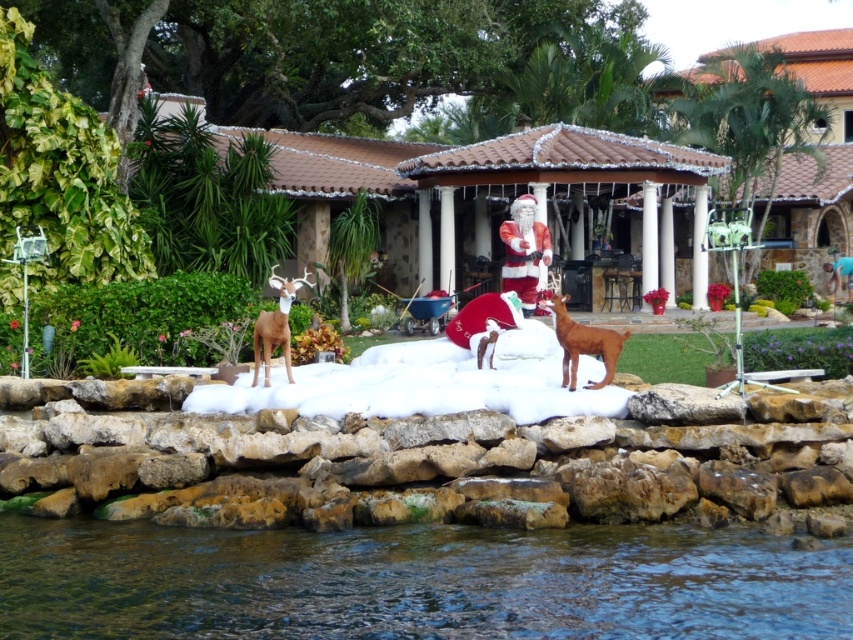
Question: Which point is farther to the camera?

Choices:
 (A) matte red santa at center
 (B) white fluffy snow at center

Answer: (A)

Question: Can you confirm if clear water at lower center is bigger than matte red santa at center?

Choices:
 (A) yes
 (B) no

Answer: (A)

Question: Which point is farther to the camera?

Choices:
 (A) (592, 385)
 (B) (367, 355)
 (C) (514, 214)
 (D) (260, 317)

Answer: (C)

Question: Which point is closer to the camera?

Choices:
 (A) (567, 360)
 (B) (393, 392)
 (C) (502, 227)

Answer: (B)

Question: Does brown matte dog at center have a greater width compared to shiny brown deer at center?

Choices:
 (A) no
 (B) yes

Answer: (A)

Question: Where is clear water at lower center located in relation to brown matte dog at center in the image?

Choices:
 (A) above
 (B) below

Answer: (B)